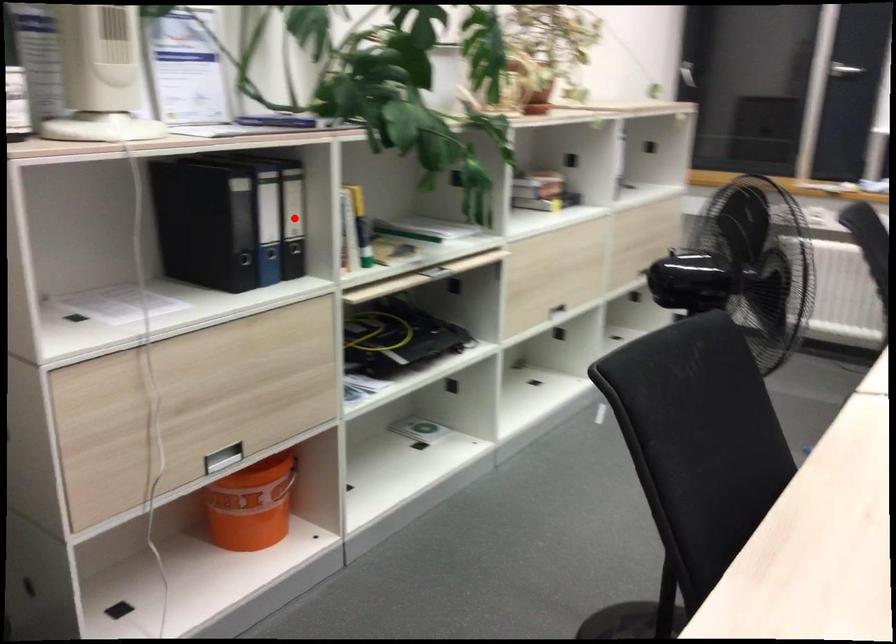
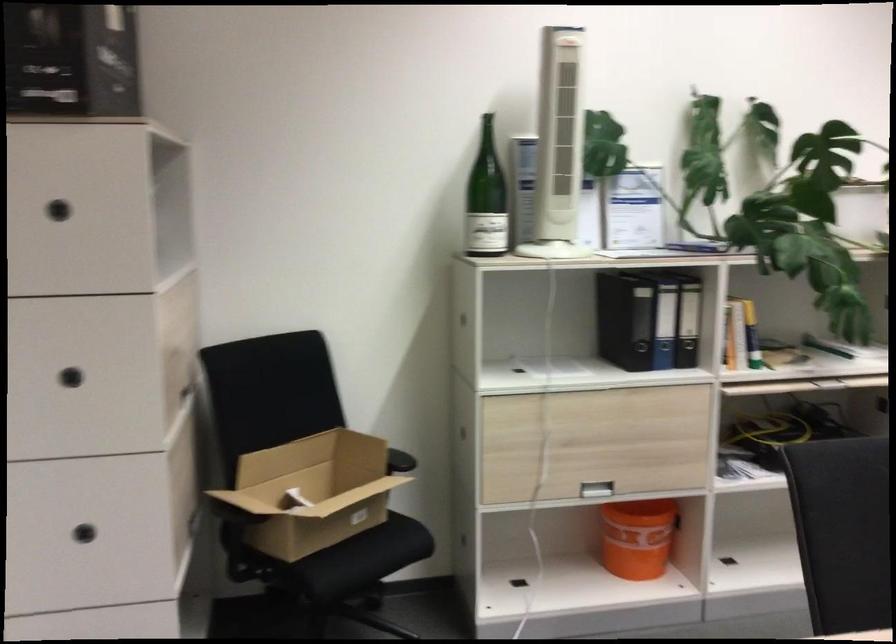
Question: A red point is marked in image1. In image2, is the corresponding 3D point closer to the camera or farther? Reply with the corresponding letter.

Choices:
 (A) The corresponding 3D point is closer.
 (B) The corresponding 3D point is farther.

Answer: (B)